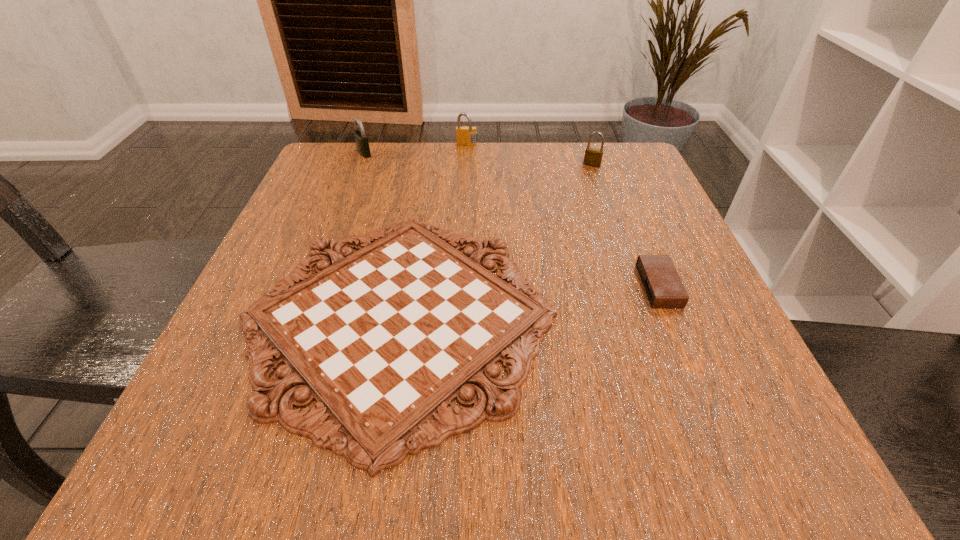
You are a GUI agent. You are given a task and a screenshot of the screen. Output one action in this format:
    pyautogui.click(x=<x>, y=<y>)
    Task: Click on the free location that satisfies the following two spatial constraints: 1. on the front side of the third farthest object; 2. on the right side of the leftmost padlock
    The width and height of the screenshot is (960, 540).
    Given the screenshot: What is the action you would take?
    pyautogui.click(x=360, y=165)

Locate an element on the screen. The height and width of the screenshot is (540, 960). vacant region that satisfies the following two spatial constraints: 1. on the back side of the rightmost padlock; 2. on the left side of the chessboard is located at coordinates (425, 165).